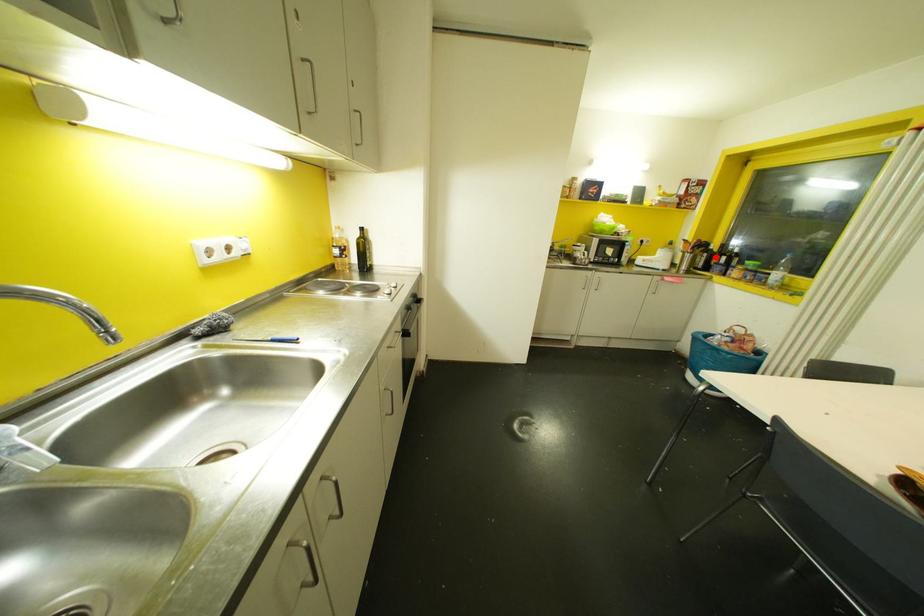
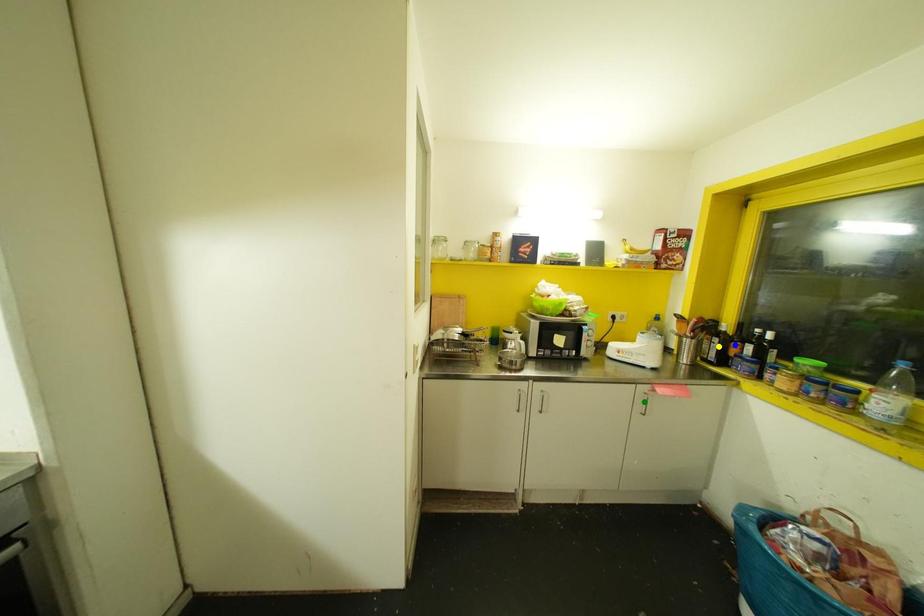
Question: I am providing you with two images of the same scene from different viewpoints. A red point is marked on the first image. You are given multiple points on the second image. In image 2, which mark is for the same physical point as the one in image 1?

Choices:
 (A) green point
 (B) blue point
 (C) yellow point

Answer: (B)